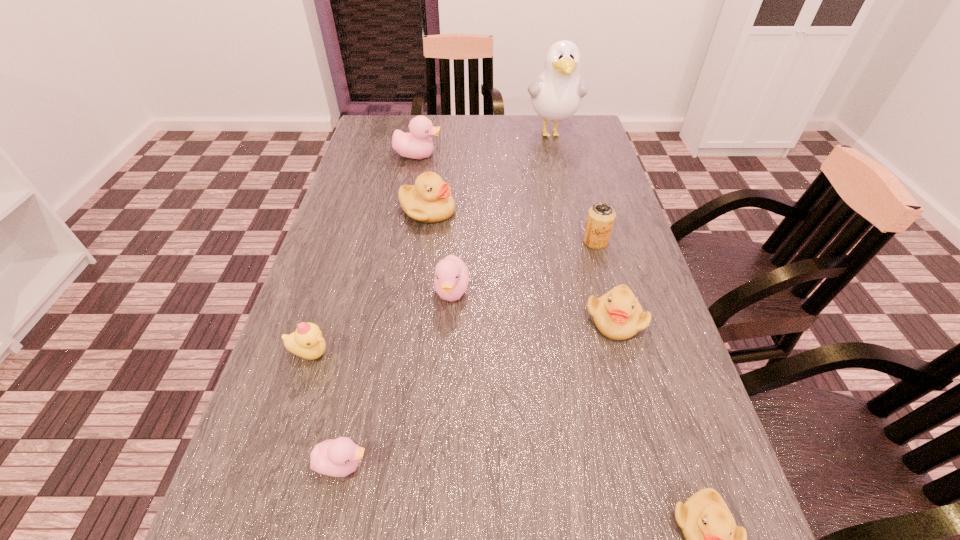
Where is `white gull`? white gull is located at coordinates (556, 95).

At what (x,y) coordinates should I click in order to perform the action: click on the tallest object. Please return your answer as a coordinate pair (x, y). The width and height of the screenshot is (960, 540). Looking at the image, I should click on (556, 95).

Find the location of a particular element. The image size is (960, 540). the farthest pink duckling is located at coordinates (417, 144).

Where is `the farthest duckling`? This screenshot has width=960, height=540. the farthest duckling is located at coordinates (417, 144).

Where is `the farthest yellow duckling`? The image size is (960, 540). the farthest yellow duckling is located at coordinates (429, 200).

Image resolution: width=960 pixels, height=540 pixels. Identify the location of the seventh nearest object. pos(429,200).

Identify the location of the sixth nearest object. Image resolution: width=960 pixels, height=540 pixels. (601, 216).

Locate an element on the screen. the second smallest pink duckling is located at coordinates (451, 279).

Where is `the rightmost pink duckling`? The height and width of the screenshot is (540, 960). the rightmost pink duckling is located at coordinates [451, 279].

At what (x,y) coordinates should I click in order to perform the action: click on the leftmost object. Please return your answer as a coordinate pair (x, y). This screenshot has height=540, width=960. Looking at the image, I should click on pos(307,342).